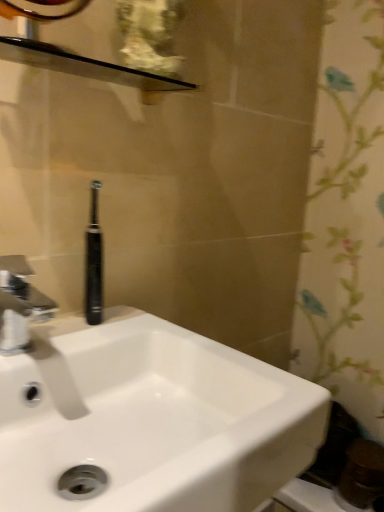
Question: Is black rubber toothbrush at center behind silver metallic faucet at left?

Choices:
 (A) yes
 (B) no

Answer: (A)

Question: Can you confirm if black rubber toothbrush at center is wider than silver metallic faucet at left?

Choices:
 (A) yes
 (B) no

Answer: (B)

Question: Would you consider black rubber toothbrush at center to be distant from silver metallic faucet at left?

Choices:
 (A) no
 (B) yes

Answer: (A)

Question: From a real-world perspective, is black rubber toothbrush at center located beneath silver metallic faucet at left?

Choices:
 (A) no
 (B) yes

Answer: (A)

Question: Is black rubber toothbrush at center at the left side of silver metallic faucet at left?

Choices:
 (A) no
 (B) yes

Answer: (A)

Question: From the image's perspective, is black glossy balustrade at upper center located above or below white glossy sink at center?

Choices:
 (A) above
 (B) below

Answer: (A)

Question: Considering the relative positions of black glossy balustrade at upper center and white glossy sink at center in the image provided, is black glossy balustrade at upper center to the left or to the right of white glossy sink at center?

Choices:
 (A) right
 (B) left

Answer: (B)

Question: Is black glossy balustrade at upper center bigger or smaller than white glossy sink at center?

Choices:
 (A) small
 (B) big

Answer: (A)

Question: In terms of height, does black glossy balustrade at upper center look taller or shorter compared to white glossy sink at center?

Choices:
 (A) tall
 (B) short

Answer: (B)

Question: In terms of height, does black glossy balustrade at upper center look taller or shorter compared to silver metallic faucet at left?

Choices:
 (A) short
 (B) tall

Answer: (A)

Question: Is point (51, 56) closer or farther from the camera than point (23, 304)?

Choices:
 (A) farther
 (B) closer

Answer: (B)

Question: From the image's perspective, is black glossy balustrade at upper center located above or below silver metallic faucet at left?

Choices:
 (A) above
 (B) below

Answer: (A)

Question: In terms of width, does black glossy balustrade at upper center look wider or thinner when compared to silver metallic faucet at left?

Choices:
 (A) wide
 (B) thin

Answer: (B)

Question: Is silver metallic faucet at left in front of or behind white glossy sink at center in the image?

Choices:
 (A) behind
 (B) front

Answer: (A)

Question: Based on their positions, is silver metallic faucet at left located to the left or right of white glossy sink at center?

Choices:
 (A) right
 (B) left

Answer: (B)